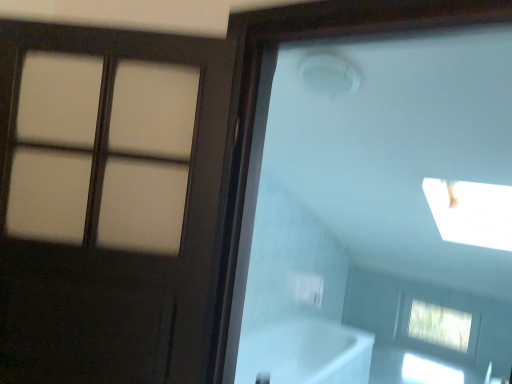
Question: Can we say white glossy bathtub at lower center lies outside matte brown door at left?

Choices:
 (A) yes
 (B) no

Answer: (A)

Question: From the image's perspective, is white glossy bathtub at lower center over matte brown door at left?

Choices:
 (A) no
 (B) yes

Answer: (A)

Question: Could you tell me if white glossy bathtub at lower center is turned towards matte brown door at left?

Choices:
 (A) yes
 (B) no

Answer: (B)

Question: From a real-world perspective, is white glossy bathtub at lower center over matte brown door at left?

Choices:
 (A) no
 (B) yes

Answer: (A)

Question: Can you confirm if white glossy bathtub at lower center is thinner than matte brown door at left?

Choices:
 (A) yes
 (B) no

Answer: (B)

Question: Does white glossy bathtub at lower center lie behind matte brown door at left?

Choices:
 (A) yes
 (B) no

Answer: (A)

Question: Does white glossy bathtub at lower center have a smaller size compared to clear glass window at lower right?

Choices:
 (A) yes
 (B) no

Answer: (B)

Question: Considering the relative sizes of white glossy bathtub at lower center and clear glass window at lower right in the image provided, is white glossy bathtub at lower center thinner than clear glass window at lower right?

Choices:
 (A) yes
 (B) no

Answer: (B)

Question: From the image's perspective, does white glossy bathtub at lower center appear higher than clear glass window at lower right?

Choices:
 (A) no
 (B) yes

Answer: (B)

Question: Is white glossy bathtub at lower center shorter than clear glass window at lower right?

Choices:
 (A) no
 (B) yes

Answer: (A)

Question: Can you confirm if white glossy bathtub at lower center is taller than clear glass window at lower right?

Choices:
 (A) no
 (B) yes

Answer: (B)

Question: Is white glossy bathtub at lower center in front of clear glass window at lower right?

Choices:
 (A) no
 (B) yes

Answer: (B)

Question: Considering the relative positions of matte brown door at left and clear glass window at lower right in the image provided, is matte brown door at left to the right of clear glass window at lower right from the viewer's perspective?

Choices:
 (A) yes
 (B) no

Answer: (B)